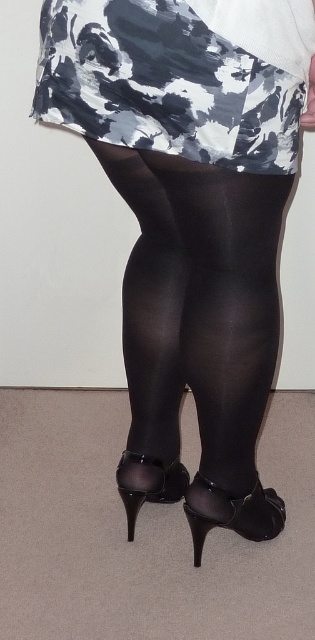
You are a fashion designer analyzing the outfit. Which object has a larger size between the white and gray abstract fabric at upper center and the black satin stocking at lower center?

The white and gray abstract fabric at upper center has a larger size compared to the black satin stocking at lower center.

You are a fashion designer analyzing the placement of elements in this outfit. The black sheer tights at center are marked by point (228,336). How does this coordinate affect the visual balance of the outfit?

The black sheer tights at center, marked by point (228,336), are centrally positioned which contributes to a balanced and harmonious visual composition in the outfit.

You are a fashion designer assessing a model wearing the described outfit. You need to determine if the skirt with the white and gray abstract fabric at upper center will cover the black glossy tights at center adequately. Based on the height of the fabric and tights, can the skirt sufficiently cover the tights?

The white and gray abstract fabric at upper center has a lesser height compared to the black glossy tights at center, meaning the skirt does not extend as low as the tights. Therefore, the skirt will not fully cover the tights, leaving part of them visible.